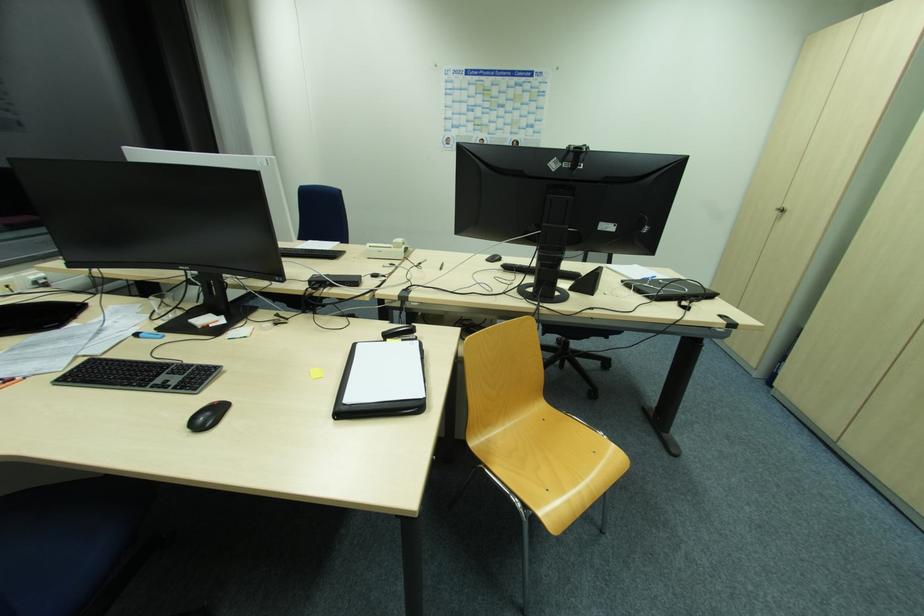
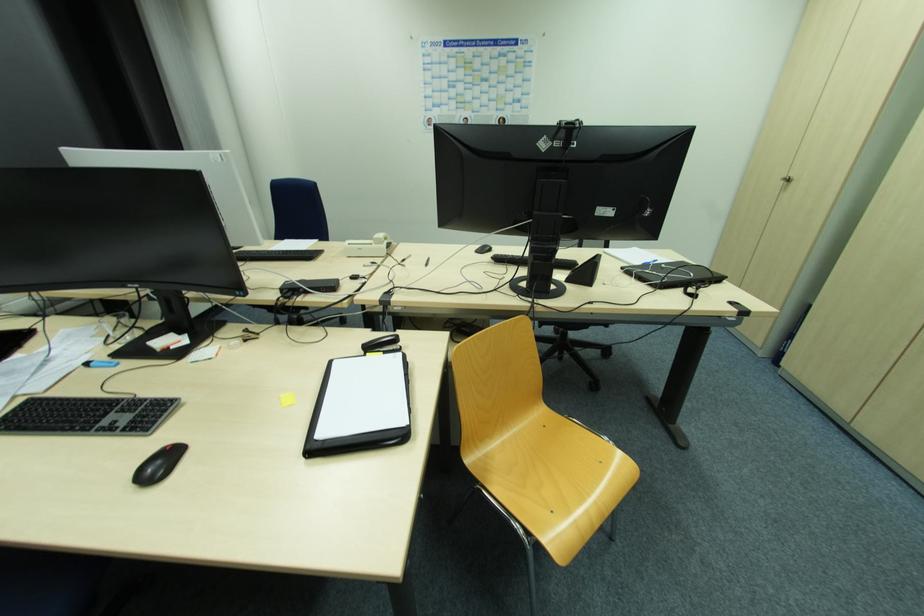
In the second image, find the point that corresponds to (393,249) in the first image.

(373, 245)